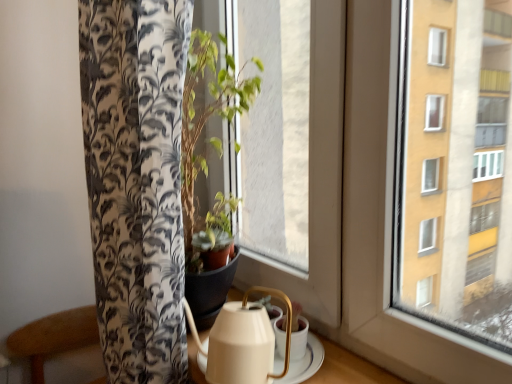
Measure the distance between white ceramic tea set at lower center and camera.

67.70 centimeters.

You are a GUI agent. You are given a task and a screenshot of the screen. Output one action in this format:
    pyautogui.click(x=<x>, y=<y>)
    Task: Click on the white ceramic tea set at lower center
    
    Given the screenshot: What is the action you would take?
    pyautogui.click(x=251, y=345)

Image resolution: width=512 pixels, height=384 pixels. What do you see at coordinates (251, 345) in the screenshot?
I see `white ceramic tea set at lower center` at bounding box center [251, 345].

What is the approximate height of white ceramic tea set at lower center?

white ceramic tea set at lower center is 17.64 centimeters tall.

Describe the element at coordinates (317, 179) in the screenshot. I see `transparent glass window at center` at that location.

Identify the location of transparent glass window at center. This screenshot has height=384, width=512. (317, 179).

From the picture: Measure the distance between transparent glass window at center and camera.

transparent glass window at center is 29.49 inches away from camera.

Identify the location of white ceramic tea set at lower center. The height and width of the screenshot is (384, 512). (x=251, y=345).

In the scene shown: Is transparent glass window at center to the right of white ceramic tea set at lower center from the viewer's perspective?

In fact, transparent glass window at center is to the left of white ceramic tea set at lower center.

Which object is more forward, transparent glass window at center or white ceramic tea set at lower center?

white ceramic tea set at lower center is closer to the camera.

Is point (253, 282) positioned in front of point (319, 352)?

No, (253, 282) is behind (319, 352).

From the image's perspective, would you say transparent glass window at center is positioned over white ceramic tea set at lower center?

Yes.

From a real-world perspective, is transparent glass window at center positioned above or below white ceramic tea set at lower center?

transparent glass window at center is above white ceramic tea set at lower center.

Which object is wider, transparent glass window at center or white ceramic tea set at lower center?

Wider between the two is white ceramic tea set at lower center.

Can you confirm if transparent glass window at center is shorter than white ceramic tea set at lower center?

No.

Does transparent glass window at center have a smaller size compared to white ceramic tea set at lower center?

No.

Is transparent glass window at center not inside white ceramic tea set at lower center?

Yes.

Is transparent glass window at center next to white ceramic tea set at lower center and touching it?

No.

Does transparent glass window at center turn towards white ceramic tea set at lower center?

No, transparent glass window at center is not oriented towards white ceramic tea set at lower center.

The height and width of the screenshot is (384, 512). In order to click on window above the white ceramic tea set at lower center (from the image's perspective) in this screenshot , I will do `click(317, 179)`.

Which is more to the left, white ceramic tea set at lower center or transparent glass window at center?

From the viewer's perspective, transparent glass window at center appears more on the left side.

Is white ceramic tea set at lower center in front of or behind transparent glass window at center in the image?

white ceramic tea set at lower center is in front of transparent glass window at center.

Is point (200, 347) farther from viewer compared to point (320, 211)?

No, (200, 347) is closer to viewer.

From the image's perspective, is white ceramic tea set at lower center located beneath transparent glass window at center?

Indeed, from the image's perspective, white ceramic tea set at lower center is shown beneath transparent glass window at center.

From a real-world perspective, is white ceramic tea set at lower center beneath transparent glass window at center?

Yes, from a real-world perspective, white ceramic tea set at lower center is beneath transparent glass window at center.

Between white ceramic tea set at lower center and transparent glass window at center, which one has larger width?

Wider between the two is white ceramic tea set at lower center.

From the picture: Does white ceramic tea set at lower center have a greater height compared to transparent glass window at center?

No, white ceramic tea set at lower center is not taller than transparent glass window at center.

Between white ceramic tea set at lower center and transparent glass window at center, which one has smaller size?

With smaller size is white ceramic tea set at lower center.

Is white ceramic tea set at lower center not within transparent glass window at center?

white ceramic tea set at lower center is positioned outside transparent glass window at center.

Is white ceramic tea set at lower center far from transparent glass window at center?

They are positioned close to each other.

Is white ceramic tea set at lower center facing away from transparent glass window at center?

No.

Consider the image. Can you tell me how much white ceramic tea set at lower center and transparent glass window at center differ in facing direction?

2.84 degrees.

Locate an element on the screen. The image size is (512, 384). tea set below the transparent glass window at center (from the image's perspective) is located at coordinates (251, 345).

In order to click on tea set below the transparent glass window at center (from a real-world perspective) in this screenshot , I will do `click(251, 345)`.

This screenshot has height=384, width=512. I want to click on tea set located on the right of transparent glass window at center, so click(251, 345).